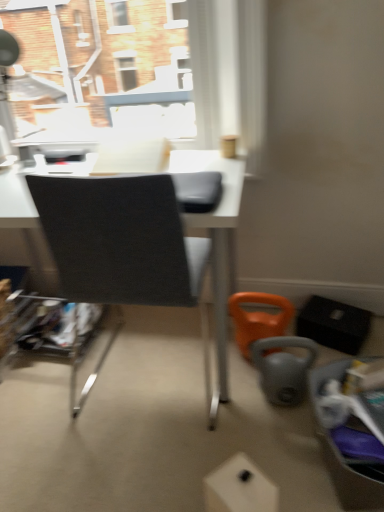
What do you see at coordinates (124, 246) in the screenshot? I see `black fabric chair at center` at bounding box center [124, 246].

The width and height of the screenshot is (384, 512). Identify the location of black fabric chair at center. (124, 246).

Find the location of a particular element. Image resolution: width=384 pixels, height=512 pixels. black fabric chair at center is located at coordinates (124, 246).